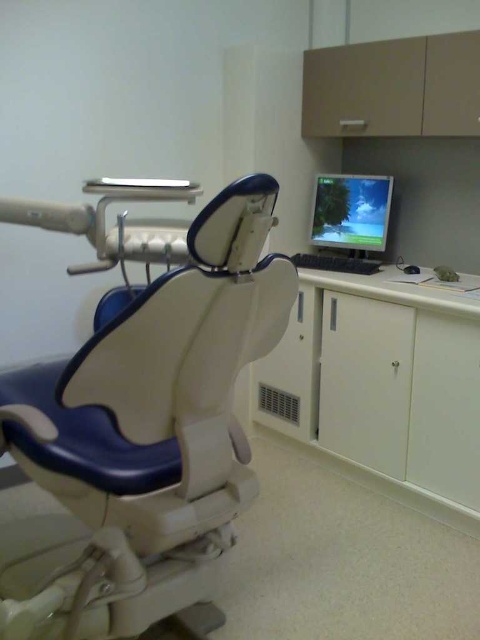
Which is above, white glossy cabinet at lower right or matte plastic monitor at upper right?

matte plastic monitor at upper right is higher up.

Who is shorter, white glossy cabinet at lower right or matte plastic monitor at upper right?

matte plastic monitor at upper right is shorter.

Identify the location of white glossy cabinet at lower right. The width and height of the screenshot is (480, 640). (380, 384).

You are a GUI agent. You are given a task and a screenshot of the screen. Output one action in this format:
    pyautogui.click(x=<x>, y=<y>)
    Task: Click on the white glossy cabinet at lower right
    
    Given the screenshot: What is the action you would take?
    pyautogui.click(x=380, y=384)

Does white leather swivel chair at left have a smaller size compared to white glossy cabinet at lower right?

Actually, white leather swivel chair at left might be larger than white glossy cabinet at lower right.

Where is `white leather swivel chair at left`? This screenshot has width=480, height=640. white leather swivel chair at left is located at coordinates (144, 433).

The height and width of the screenshot is (640, 480). What are the coordinates of `white leather swivel chair at left` in the screenshot? It's located at (144, 433).

Does point (211, 282) lie in front of point (324, 228)?

Yes, it is in front of point (324, 228).

Can you confirm if white leather swivel chair at left is shorter than matte plastic monitor at upper right?

No, white leather swivel chair at left is not shorter than matte plastic monitor at upper right.

Does point (188, 534) come behind point (352, 237)?

No, it is not.

What are the coordinates of `white leather swivel chair at left` in the screenshot? It's located at (144, 433).